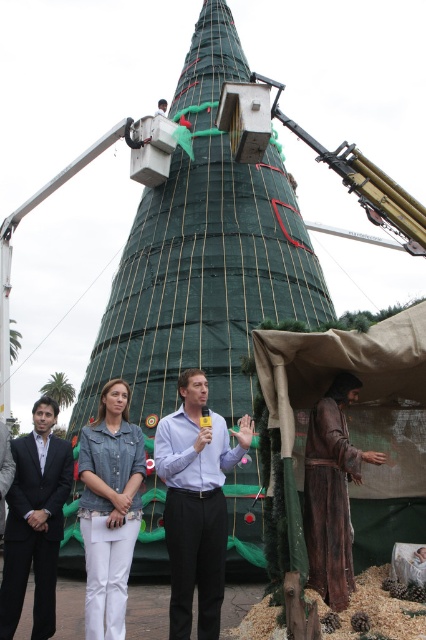
Does matte blue shirt at center have a larger size compared to dark blue suit at lower left?

Yes.

Is matte blue shirt at center closer to the viewer compared to dark blue suit at lower left?

Yes, matte blue shirt at center is in front of dark blue suit at lower left.

Is point (221, 472) closer to viewer compared to point (36, 588)?

No.

The image size is (426, 640). In order to click on matte blue shirt at center in this screenshot , I will do `click(195, 502)`.

Can you confirm if green netted christmas tree at center is taller than brown leather robe at lower right?

Indeed, green netted christmas tree at center has a greater height compared to brown leather robe at lower right.

Between point (178, 260) and point (328, 403), which one is positioned in front?

Positioned in front is point (328, 403).

Identify the location of green netted christmas tree at center. The image size is (426, 640). (204, 257).

Does green netted christmas tree at center lie behind matte blue shirt at center?

Yes, green netted christmas tree at center is further from the viewer.

Where is `green netted christmas tree at center`? This screenshot has width=426, height=640. green netted christmas tree at center is located at coordinates pos(204,257).